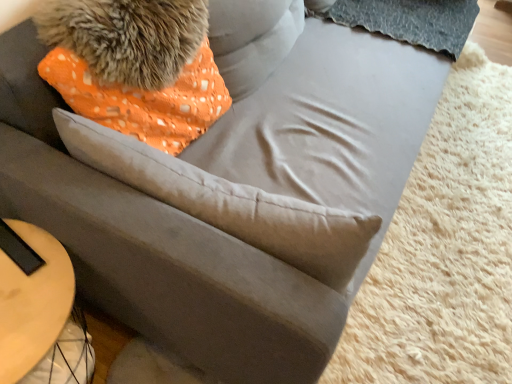
Question: From a real-world perspective, is orange dotted fabric pillow at upper left positioned under fuzzy fur at upper left based on gravity?

Choices:
 (A) no
 (B) yes

Answer: (B)

Question: Is fuzzy fur at upper left inside orange dotted fabric pillow at upper left?

Choices:
 (A) no
 (B) yes

Answer: (A)

Question: From the image's perspective, is orange dotted fabric pillow at upper left located above fuzzy fur at upper left?

Choices:
 (A) yes
 (B) no

Answer: (B)

Question: Can you confirm if orange dotted fabric pillow at upper left is taller than fuzzy fur at upper left?

Choices:
 (A) no
 (B) yes

Answer: (B)

Question: Is orange dotted fabric pillow at upper left facing away from fuzzy fur at upper left?

Choices:
 (A) no
 (B) yes

Answer: (A)

Question: From a real-world perspective, is fuzzy fur at upper left positioned above or below orange dotted fabric pillow at upper left?

Choices:
 (A) above
 (B) below

Answer: (A)

Question: Is fuzzy fur at upper left taller or shorter than orange dotted fabric pillow at upper left?

Choices:
 (A) tall
 (B) short

Answer: (B)

Question: From the image's perspective, is fuzzy fur at upper left located above or below orange dotted fabric pillow at upper left?

Choices:
 (A) above
 (B) below

Answer: (A)

Question: Based on their positions, is fuzzy fur at upper left located to the left or right of orange dotted fabric pillow at upper left?

Choices:
 (A) right
 (B) left

Answer: (B)

Question: From a real-world perspective, is fuzzy fur at upper left positioned above or below light wood table at lower left?

Choices:
 (A) below
 (B) above

Answer: (B)

Question: Is fuzzy fur at upper left bigger or smaller than light wood table at lower left?

Choices:
 (A) big
 (B) small

Answer: (B)

Question: From the image's perspective, is fuzzy fur at upper left located above or below light wood table at lower left?

Choices:
 (A) below
 (B) above

Answer: (B)

Question: Is point (117, 11) positioned closer to the camera than point (27, 336)?

Choices:
 (A) closer
 (B) farther

Answer: (B)

Question: Do you think light wood table at lower left is within orange dotted fabric pillow at upper left, or outside of it?

Choices:
 (A) inside
 (B) outside

Answer: (B)

Question: Considering the positions of light wood table at lower left and orange dotted fabric pillow at upper left in the image, is light wood table at lower left bigger or smaller than orange dotted fabric pillow at upper left?

Choices:
 (A) big
 (B) small

Answer: (B)